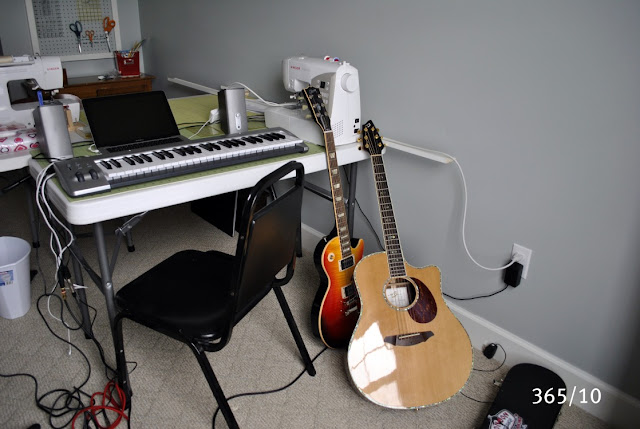
Where is `chair`? The width and height of the screenshot is (640, 429). chair is located at coordinates [x=205, y=298].